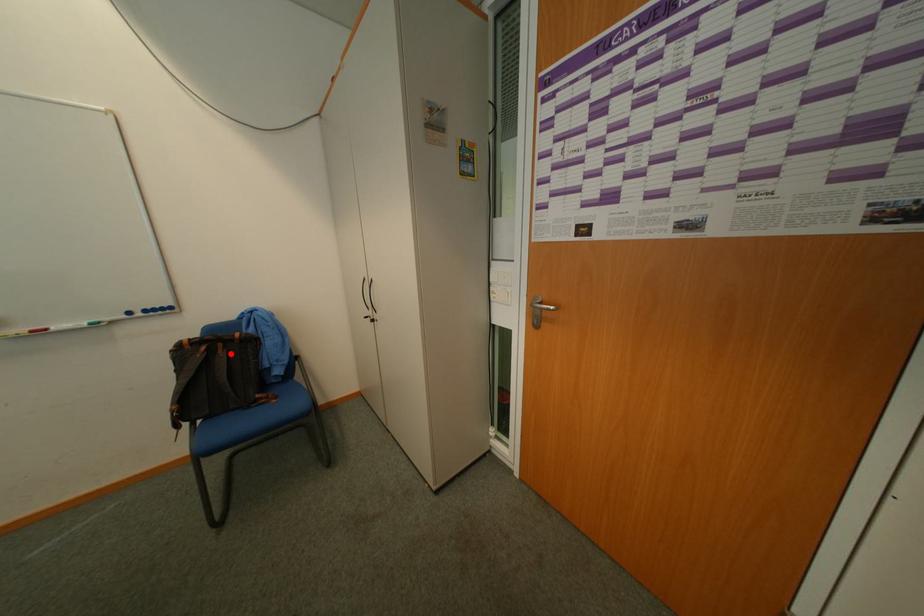
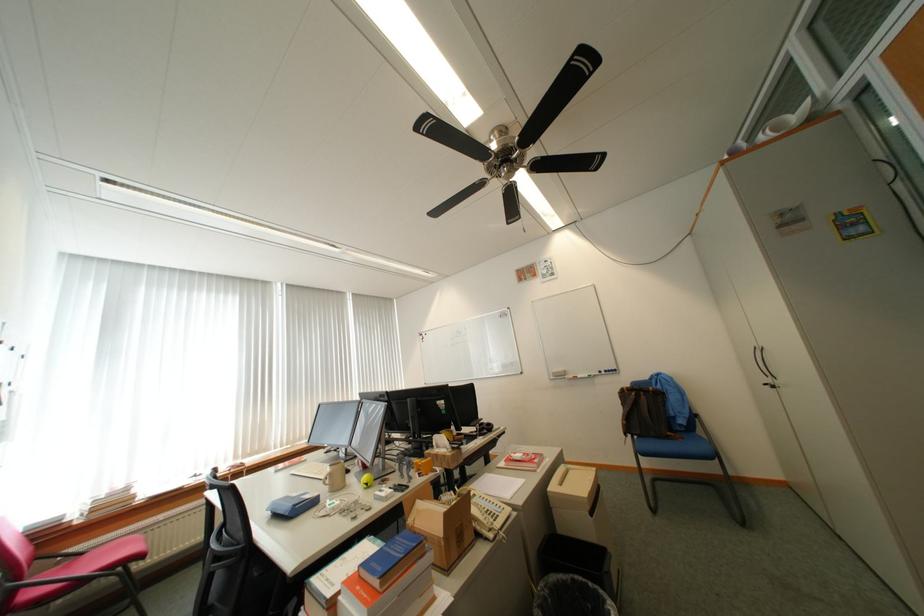
Question: I am providing you with two images of the same scene from different viewpoints. A red point is shown in image1. For the corresponding object point in image2, is it positioned nearer or farther from the camera?

Choices:
 (A) Nearer
 (B) Farther

Answer: (B)